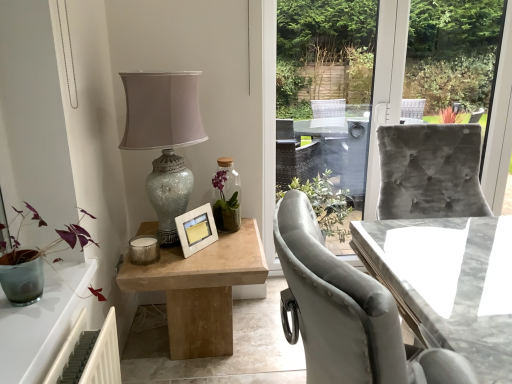
Find the location of `free space to the right of white matte picture frame at center`. free space to the right of white matte picture frame at center is located at coordinates [x=227, y=251].